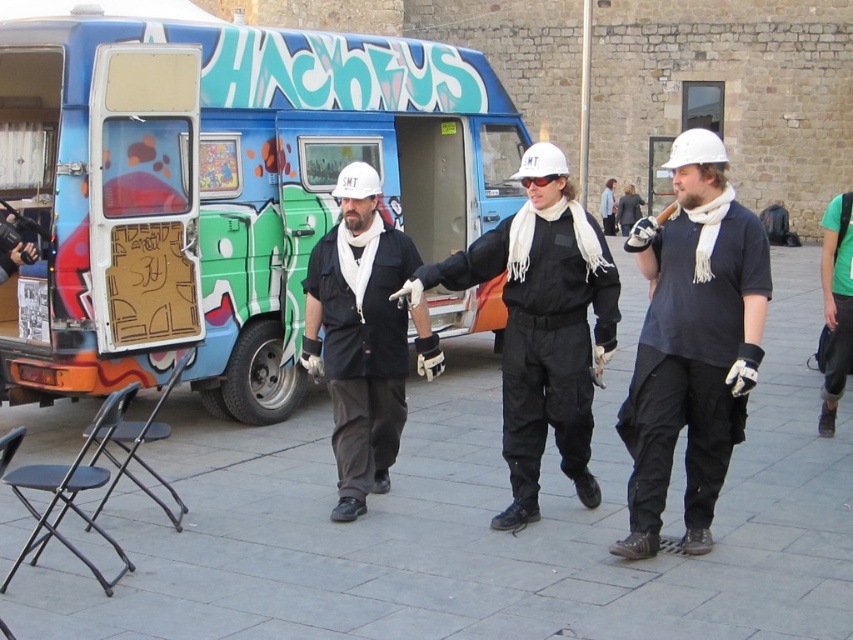
Question: Which point is farther to the camera?

Choices:
 (A) white matte helmet at center
 (B) black matte jacket at center
 (C) black matte shirt at center

Answer: (C)

Question: Among these objects, which one is nearest to the camera?

Choices:
 (A) white matte helmet at center
 (B) black matte shirt at center

Answer: (A)

Question: Does white matte helmet at center come behind black matte shirt at center?

Choices:
 (A) yes
 (B) no

Answer: (B)

Question: Can you confirm if white matte helmet at center is bigger than black matte jacket at center?

Choices:
 (A) yes
 (B) no

Answer: (B)

Question: Which point is farther to the camera?

Choices:
 (A) (86, 150)
 (B) (541, 380)

Answer: (A)

Question: Is white matte helmet at center thinner than black matte shirt at center?

Choices:
 (A) no
 (B) yes

Answer: (B)